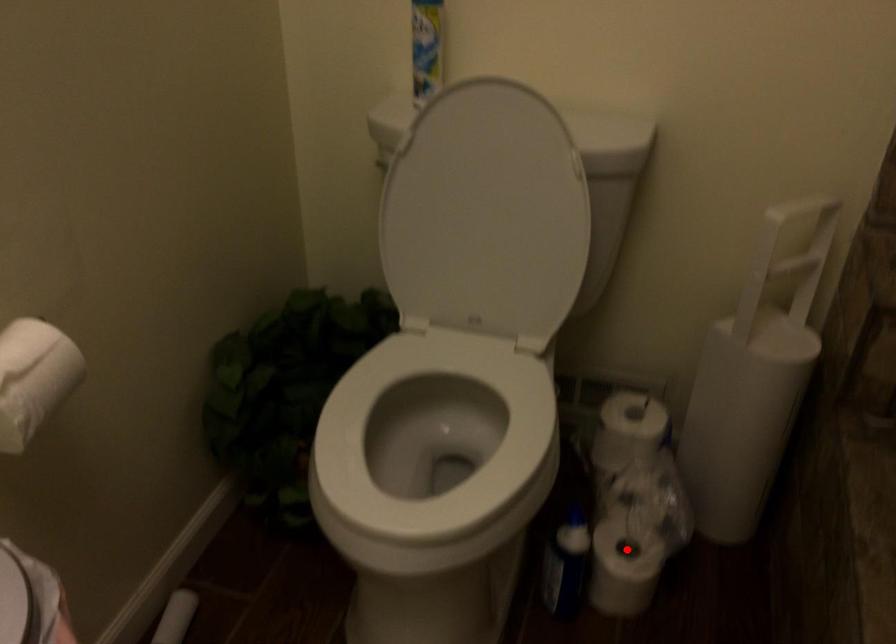
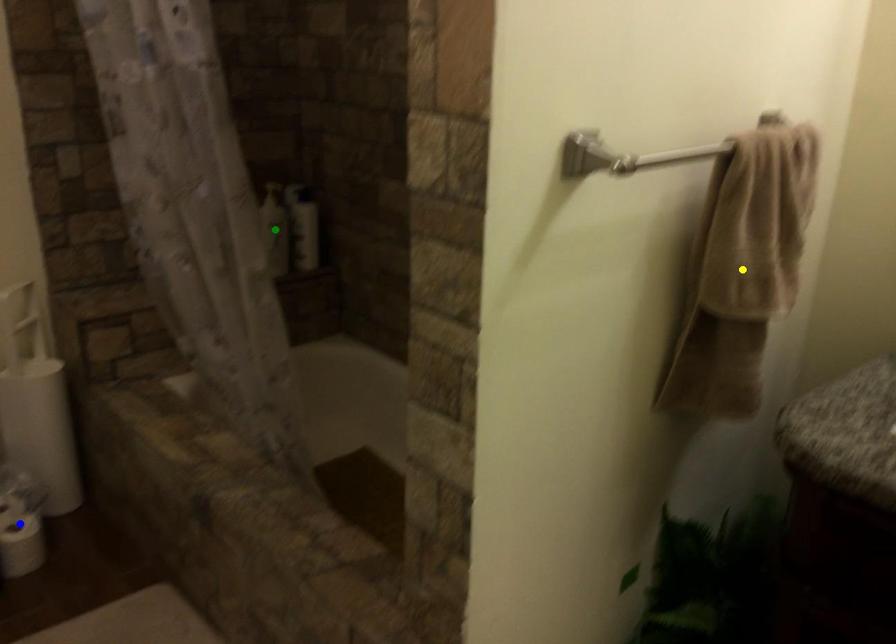
Question: I am providing you with two images of the same scene from different viewpoints. A red point is marked on the first image. You are given multiple points on the second image. Which point in image 2 is actually the same real-world point as the red point in image 1?

Choices:
 (A) blue point
 (B) green point
 (C) yellow point

Answer: (A)